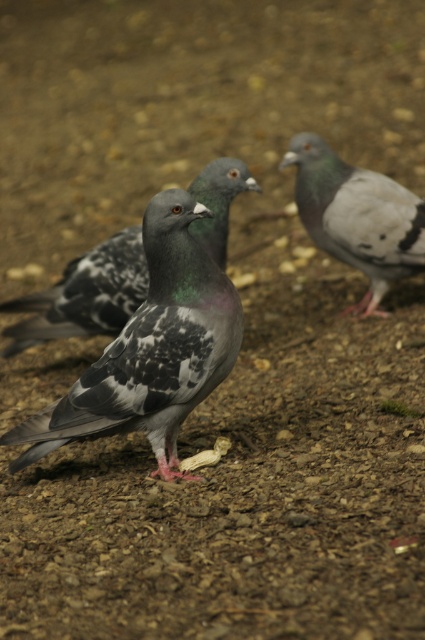
Question: Does speckled feathered pigeon at center come in front of gray matte pigeon at right?

Choices:
 (A) yes
 (B) no

Answer: (A)

Question: Which of the following is the farthest from the observer?

Choices:
 (A) gray matte pigeon at right
 (B) speckled feather pigeon at center

Answer: (A)

Question: Observing the image, what is the correct spatial positioning of gray matte pigeon at right in reference to speckled feather pigeon at center?

Choices:
 (A) left
 (B) right

Answer: (B)

Question: Which is nearer to the speckled feather pigeon at center?

Choices:
 (A) gray matte pigeon at right
 (B) speckled feathered pigeon at center

Answer: (B)

Question: Which object appears closest to the camera in this image?

Choices:
 (A) speckled feather pigeon at center
 (B) gray matte pigeon at right
 (C) speckled feathered pigeon at center

Answer: (C)

Question: Can you confirm if gray matte pigeon at right is positioned to the right of speckled feather pigeon at center?

Choices:
 (A) no
 (B) yes

Answer: (B)